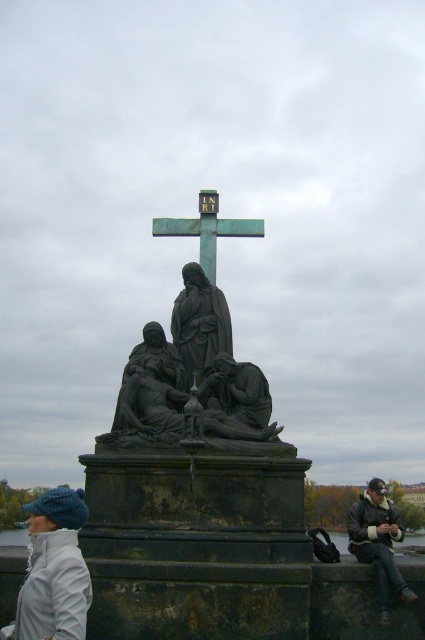
You are an art student observing the bronze statue at center and the dark brown leather jacket at lower right in the image. From your viewpoint, which object is closer to you?

The bronze statue at center is closer to you than the dark brown leather jacket at lower right because the jacket is behind the statue.

You are an art student standing in front of the bronze statue at center and the white woolen hat at lower left. Which object is closer to you?

The bronze statue at center is closer to you because it is further to the viewer than the white woolen hat at lower left.

You are an art student who wants to draw the scene. You need to know the relative sizes of the bronze statue at center and the dark brown leather jacket at lower right to scale your drawing correctly. Which object is taller?

The bronze statue at center is much taller than the dark brown leather jacket at lower right.